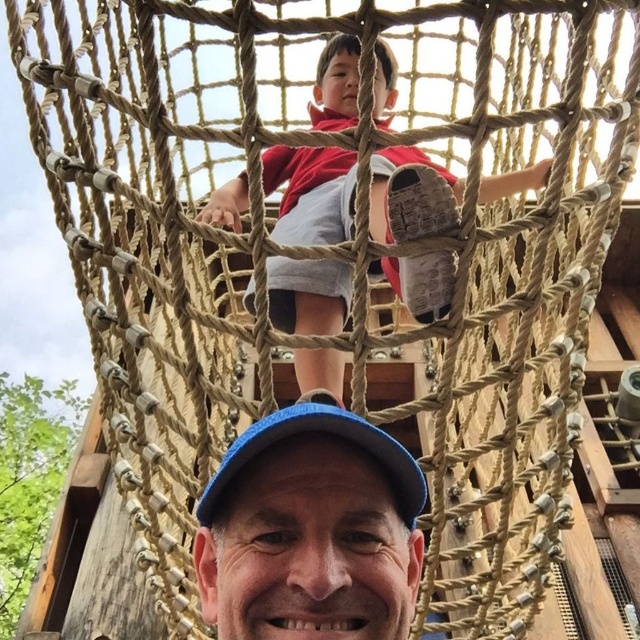
You are designing a new uniform for the playground staff and need to ensure that the red shirt and blue cap are proportionate. Given that the matte red shirt at upper center is narrower than the blue fabric baseball cap at center, how should you adjust the shirt design to maintain visual balance?

Since the matte red shirt at upper center is narrower than the blue fabric baseball cap at center, you should widen the shirt design to match the cap width for better visual balance.

You are taking a photo of the matte red shirt at upper center and the blue fabric baseball cap at center. Which object should you adjust your camera to focus on first if you want both to be in focus, considering their positions?

The matte red shirt at upper center is to the left of the blue fabric baseball cap at center. To have both in focus, adjust the camera focus starting with the matte red shirt at upper center since it is closer to the left side, ensuring the entire area between them is sharp.

You are a photographer taking a picture of the matte red shirt at upper center and the blue fabric baseball cap at center. Based on their positions, which object appears smaller in the photo?

The matte red shirt at upper center appears smaller in the photo because it has a lesser height compared to the blue fabric baseball cap at center.